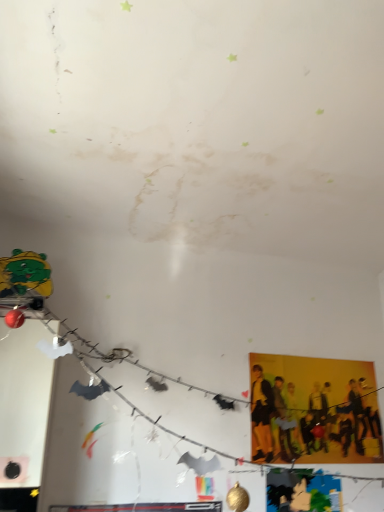
The height and width of the screenshot is (512, 384). In order to click on yellow matte poster at right in this screenshot , I will do `click(314, 410)`.

This screenshot has width=384, height=512. What do you see at coordinates (314, 410) in the screenshot? I see `yellow matte poster at right` at bounding box center [314, 410].

Where is `yellow matte poster at right`? yellow matte poster at right is located at coordinates (314, 410).